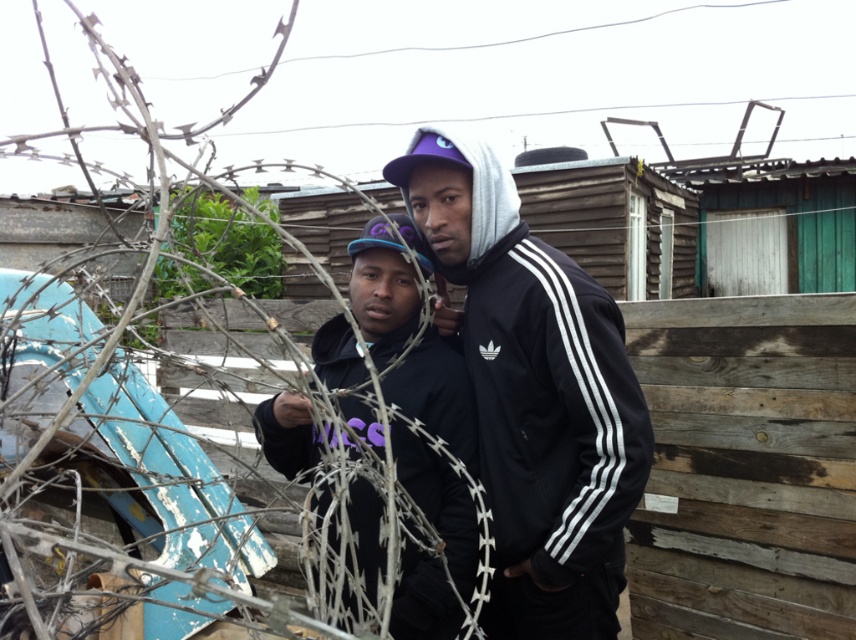
Question: Which of these objects is positioned closest to the black matte hoodie at center?

Choices:
 (A) matte black jacket at center
 (B) weathered wood fence at right

Answer: (A)

Question: Estimate the real-world distances between objects in this image. Which object is farther from the black matte hoodie at center?

Choices:
 (A) weathered wood fence at right
 (B) matte black jacket at center

Answer: (A)

Question: Where is matte black jacket at center located in relation to black matte hoodie at center in the image?

Choices:
 (A) right
 (B) left

Answer: (A)

Question: Does weathered wood fence at right have a greater width compared to black matte hoodie at center?

Choices:
 (A) no
 (B) yes

Answer: (B)

Question: From the image, what is the correct spatial relationship of matte black jacket at center in relation to black matte hoodie at center?

Choices:
 (A) below
 (B) above

Answer: (B)

Question: Which point is farther to the camera?

Choices:
 (A) (623, 372)
 (B) (846, 400)
 (C) (473, 529)

Answer: (B)